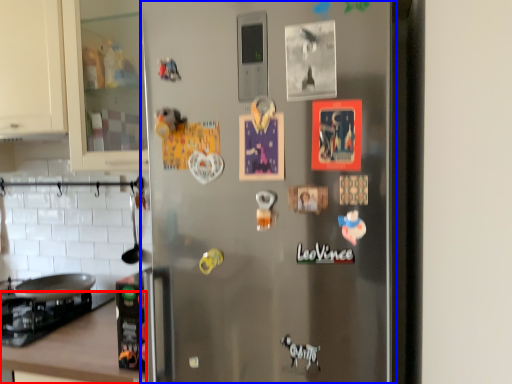
Question: Which object appears farthest to the camera in this image, counter top (highlighted by a red box) or refrigerator (highlighted by a blue box)?

Choices:
 (A) counter top
 (B) refrigerator

Answer: (A)